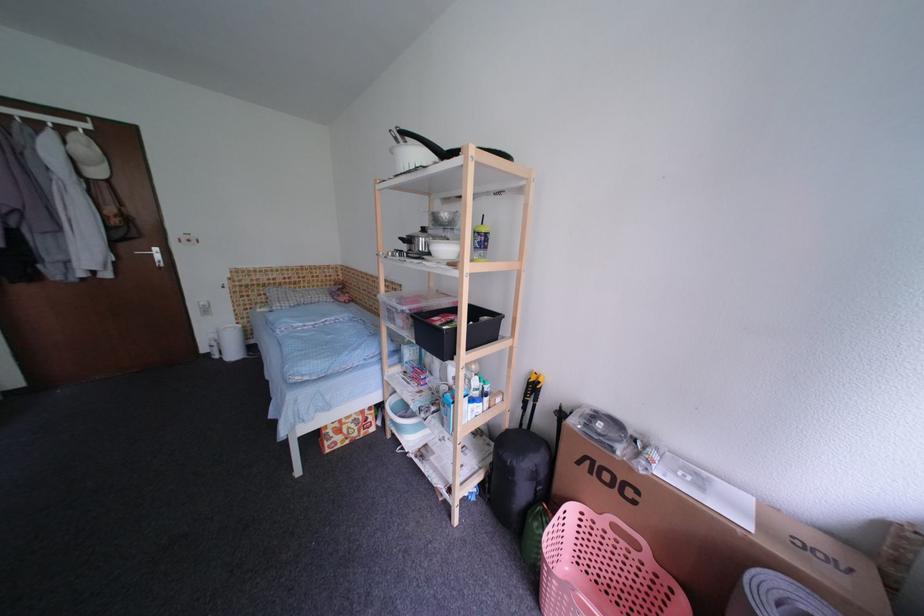
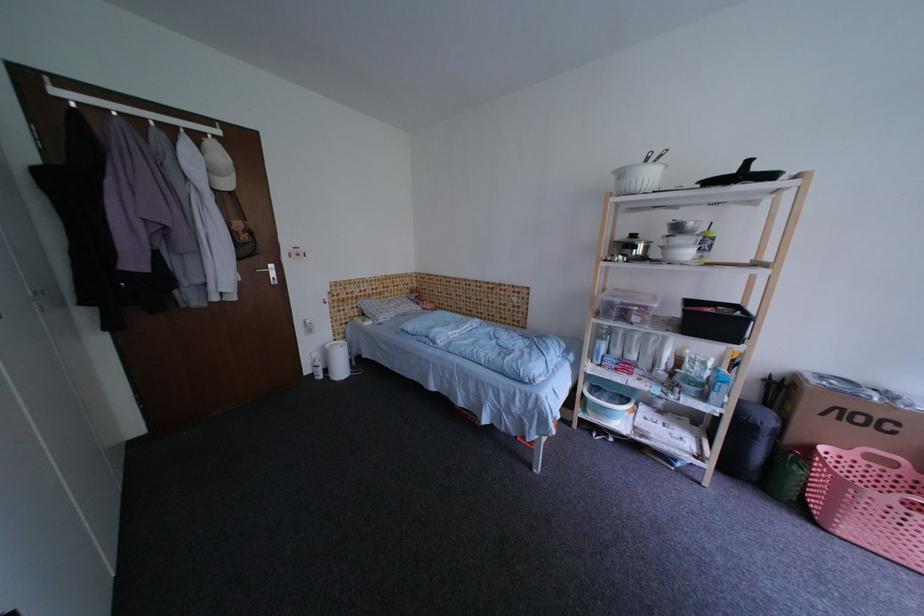
In the second image, find the point that corresponds to point (622, 531) in the first image.

(878, 459)